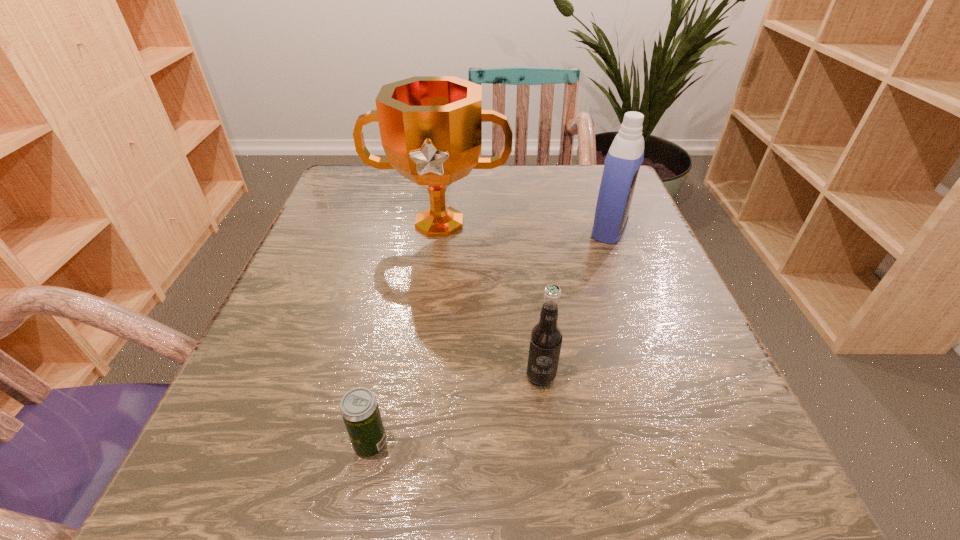
Identify the location of unoccupied position between the award and the nearest object. (405, 334).

Where is `vacant area that lies between the rightmost object and the beer can`? vacant area that lies between the rightmost object and the beer can is located at coordinates (490, 336).

Where is `vacant region between the second shortest object and the award`? vacant region between the second shortest object and the award is located at coordinates (490, 301).

Identify the location of free space between the detergent and the beer can. (490, 336).

Select which object appears as the third closest to the award. Please provide its 2D coordinates. Your answer should be formatted as a tuple, i.e. [(x, y)], where the tuple contains the x and y coordinates of a point satisfying the conditions above.

[(359, 408)]

Locate an element on the screen. the second closest object to the nearest object is located at coordinates (431, 126).

This screenshot has height=540, width=960. In order to click on free location that satisfies the following two spatial constraints: 1. on the back side of the beer can; 2. on the left side of the detergent in this screenshot , I will do `click(413, 229)`.

Find the location of a particular element. This screenshot has width=960, height=540. free space that satisfies the following two spatial constraints: 1. on the side of the detergent with the star emblem; 2. on the right side of the award is located at coordinates (439, 229).

The image size is (960, 540). Find the location of `vacant space that satisfies the following two spatial constraints: 1. on the side of the rightmost object with the star emblem; 2. on the left side of the award`. vacant space that satisfies the following two spatial constraints: 1. on the side of the rightmost object with the star emblem; 2. on the left side of the award is located at coordinates (439, 229).

What are the coordinates of `vacant space that satisfies the following two spatial constraints: 1. on the back side of the rightmost object; 2. on the right side of the beer can` in the screenshot? It's located at (413, 229).